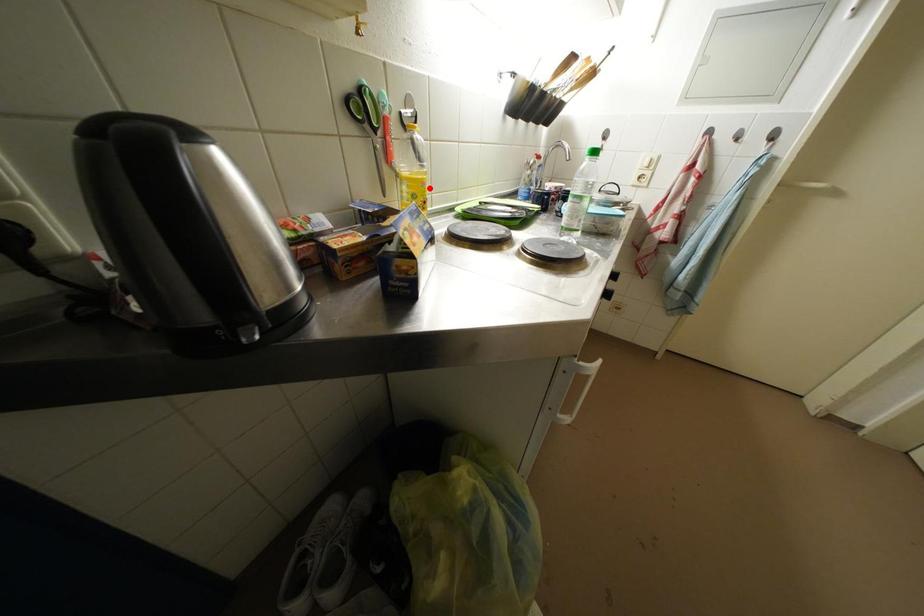
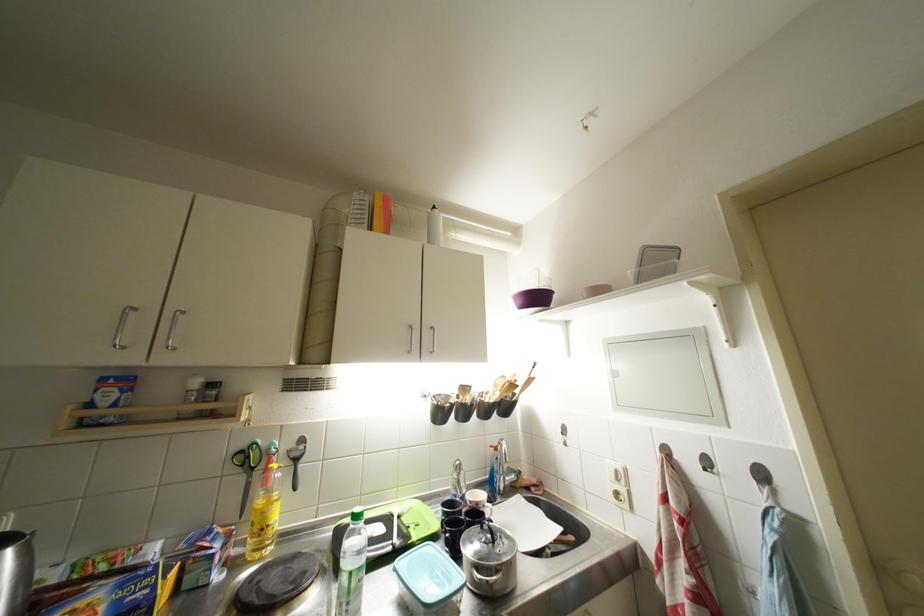
Question: A red point is marked in image1. In image2, is the corresponding 3D point closer to the camera or farther? Reply with the corresponding letter.

Choices:
 (A) The corresponding 3D point is closer.
 (B) The corresponding 3D point is farther.

Answer: (B)